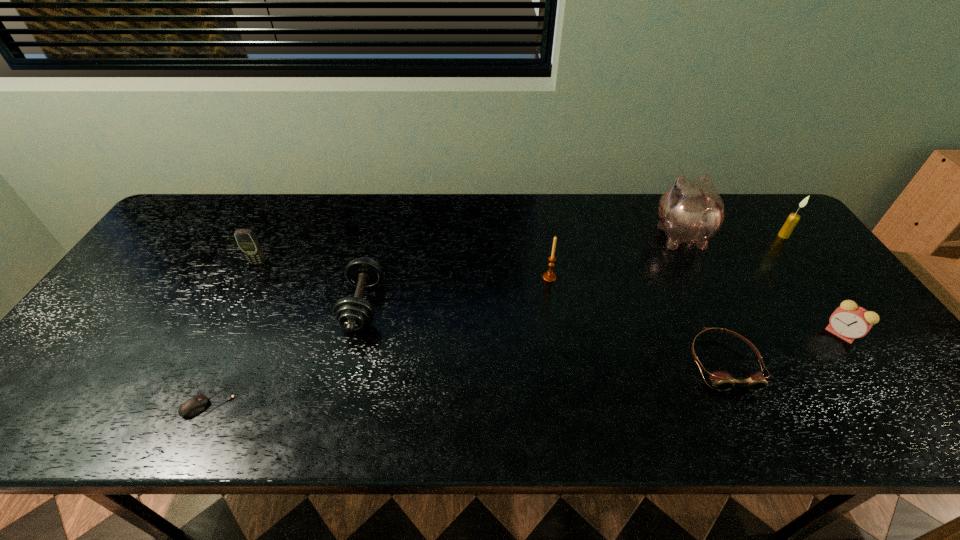
In the image, there is a desktop. Where is `free region at the far right corner`? free region at the far right corner is located at coordinates (756, 206).

In the image, there is a desktop. Where is `free space at the near right corner`? free space at the near right corner is located at coordinates (944, 423).

Where is `vacant region between the mouse and the second shortest object`? This screenshot has height=540, width=960. vacant region between the mouse and the second shortest object is located at coordinates (466, 383).

Locate an element on the screen. This screenshot has height=540, width=960. free space between the fourth object from left to right and the alarm clock is located at coordinates (695, 306).

Find the location of `vacant region between the sixth nearest object and the fifth object from right to left`. vacant region between the sixth nearest object and the fifth object from right to left is located at coordinates (403, 271).

Locate an element on the screen. unoccupied area between the piggy bank and the cellular telephone is located at coordinates (469, 249).

Locate an element on the screen. free space between the candle and the dumbbell is located at coordinates (573, 271).

What are the coordinates of `free space between the mouse and the alarm clock` in the screenshot? It's located at (525, 368).

Locate an element on the screen. empty space that is in between the mouse and the candle_holder is located at coordinates (379, 340).

Identify the location of vacant space that's between the alarm clock and the candle. The height and width of the screenshot is (540, 960). (812, 285).